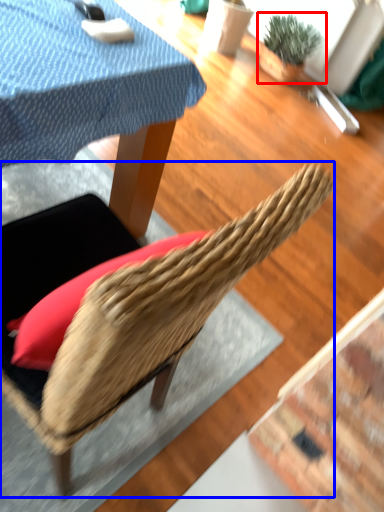
Question: Which object is further to the camera taking this photo, houseplant (highlighted by a red box) or chair (highlighted by a blue box)?

Choices:
 (A) houseplant
 (B) chair

Answer: (A)